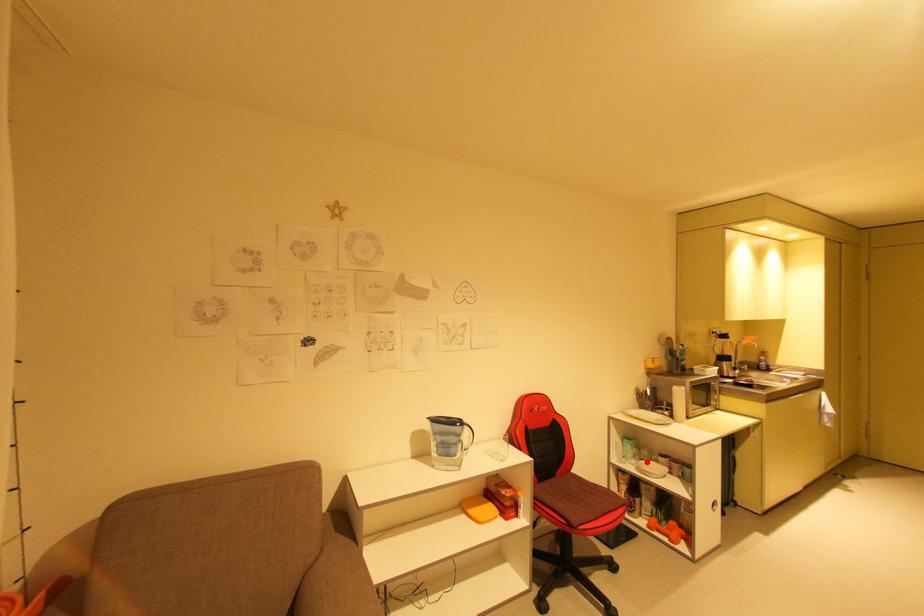
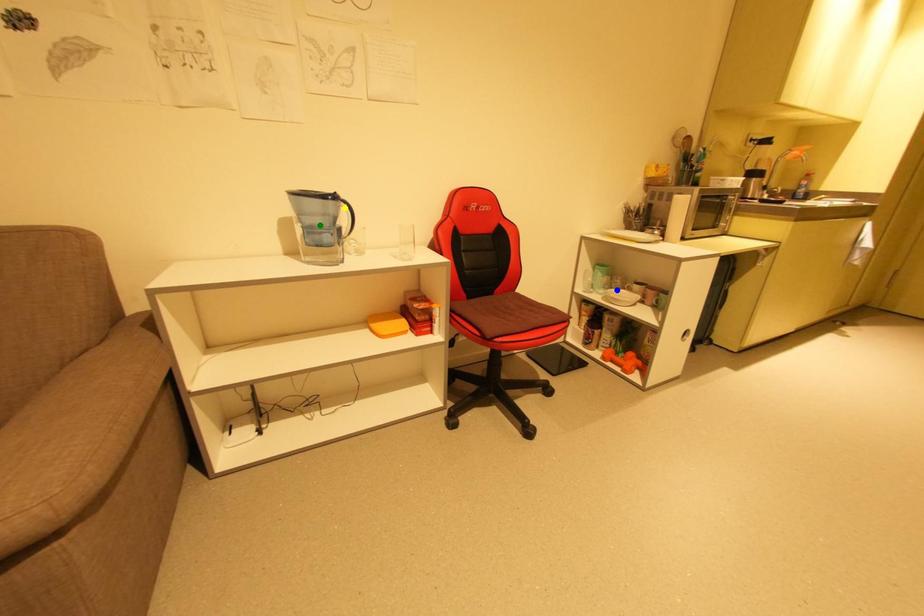
Question: I am providing you with two images of the same scene from different viewpoints. A red point is marked on the first image. You are given multiple points on the second image. Which point in image 2 is actually the same real-world point as the red point in image 1?

Choices:
 (A) yellow point
 (B) green point
 (C) blue point

Answer: (C)